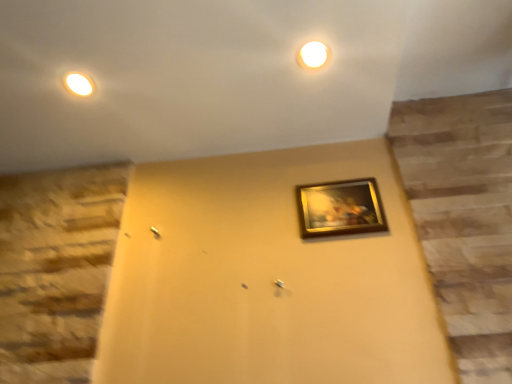
This screenshot has width=512, height=384. Describe the element at coordinates (313, 56) in the screenshot. I see `white glossy light at upper center` at that location.

Image resolution: width=512 pixels, height=384 pixels. Identify the location of white glossy light at upper center. 313,56.

Looking at this image, what is the approximate width of gold-framed painting at center?

The width of gold-framed painting at center is 0.69 inches.

What do you see at coordinates (340, 208) in the screenshot? I see `gold-framed painting at center` at bounding box center [340, 208].

Find the location of a particular element. Image resolution: width=512 pixels, height=384 pixels. gold-framed painting at center is located at coordinates tap(340, 208).

Find the location of `white glossy light at upper center`. white glossy light at upper center is located at coordinates (313, 56).

Looking at this image, which is more to the left, white glossy light at upper center or gold-framed painting at center?

Positioned to the left is white glossy light at upper center.

Is white glossy light at upper center in front of or behind gold-framed painting at center in the image?

white glossy light at upper center is in front of gold-framed painting at center.

Considering the points (300, 53) and (303, 232), which point is in front, point (300, 53) or point (303, 232)?

The point (300, 53) is more forward.

From the image's perspective, does white glossy light at upper center appear lower than gold-framed painting at center?

No.

From a real-world perspective, which object stands above the other?

From a 3D spatial view, white glossy light at upper center is above.

Between white glossy light at upper center and gold-framed painting at center, which one has smaller width?

gold-framed painting at center.

Can you confirm if white glossy light at upper center is taller than gold-framed painting at center?

No, white glossy light at upper center is not taller than gold-framed painting at center.

From the picture: Considering the relative sizes of white glossy light at upper center and gold-framed painting at center in the image provided, is white glossy light at upper center bigger than gold-framed painting at center?

No, white glossy light at upper center is not bigger than gold-framed painting at center.

Is white glossy light at upper center not within gold-framed painting at center?

Yes, white glossy light at upper center is located beyond the bounds of gold-framed painting at center.

Are white glossy light at upper center and gold-framed painting at center far apart?

No.

Is white glossy light at upper center positioned with its back to gold-framed painting at center?

That's not correct — white glossy light at upper center is not looking away from gold-framed painting at center.

Can you tell me how much white glossy light at upper center and gold-framed painting at center differ in facing direction?

89.8 degrees separate the facing orientations of white glossy light at upper center and gold-framed painting at center.

You are a GUI agent. You are given a task and a screenshot of the screen. Output one action in this format:
    pyautogui.click(x=<x>, y=<y>)
    Task: Click on the picture frame that is on the right side of white glossy light at upper center
    Image resolution: width=512 pixels, height=384 pixels.
    Given the screenshot: What is the action you would take?
    pyautogui.click(x=340, y=208)

Which object is positioned more to the left, gold-framed painting at center or white glossy light at upper center?

From the viewer's perspective, white glossy light at upper center appears more on the left side.

Does gold-framed painting at center come behind white glossy light at upper center?

Yes, it is behind white glossy light at upper center.

From the picture: Which is more distant, (302,206) or (330,52)?

Point (302,206)

Based on the photo, from the image's perspective, is gold-framed painting at center positioned above or below white glossy light at upper center?

gold-framed painting at center is below white glossy light at upper center.

From a real-world perspective, is gold-framed painting at center positioned under white glossy light at upper center based on gravity?

Yes.

Considering the sizes of objects gold-framed painting at center and white glossy light at upper center in the image provided, who is wider, gold-framed painting at center or white glossy light at upper center?

With larger width is white glossy light at upper center.

Can you confirm if gold-framed painting at center is shorter than white glossy light at upper center?

In fact, gold-framed painting at center may be taller than white glossy light at upper center.

Looking at this image, considering the sizes of gold-framed painting at center and white glossy light at upper center in the image, is gold-framed painting at center bigger or smaller than white glossy light at upper center?

gold-framed painting at center is bigger than white glossy light at upper center.

Could white glossy light at upper center be considered to be inside gold-framed painting at center?

Actually, white glossy light at upper center is outside gold-framed painting at center.

Are gold-framed painting at center and white glossy light at upper center making contact?

No.

Is gold-framed painting at center facing away from white glossy light at upper center?

No, white glossy light at upper center is not at the back of gold-framed painting at center.

Find the location of a particular element. picture frame that appears on the right of white glossy light at upper center is located at coordinates (340, 208).

There is a gold-framed painting at center. Where is `light above it (from a real-world perspective)`? The width and height of the screenshot is (512, 384). light above it (from a real-world perspective) is located at coordinates (313, 56).

Identify the location of light on the left of the gold-framed painting at center. (313, 56).